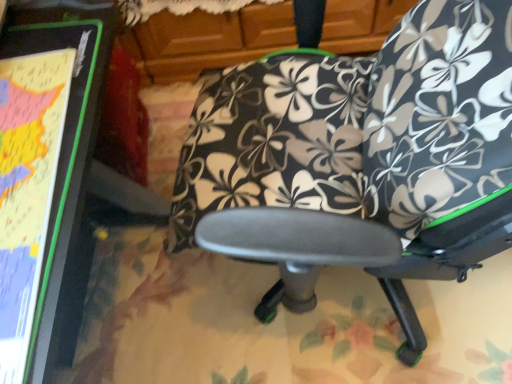
Question: From a real-world perspective, is black fabric chair at center physically located above or below matte black board at left?

Choices:
 (A) below
 (B) above

Answer: (B)

Question: From the image's perspective, is black fabric chair at center above or below matte black board at left?

Choices:
 (A) above
 (B) below

Answer: (A)

Question: Which object is the closest to the black fabric chair at center?

Choices:
 (A) black floral fabric bean bag chair at center
 (B) matte black board at left

Answer: (A)

Question: Estimate the real-world distances between objects in this image. Which object is farther from the black floral fabric bean bag chair at center?

Choices:
 (A) matte black board at left
 (B) black fabric chair at center

Answer: (A)